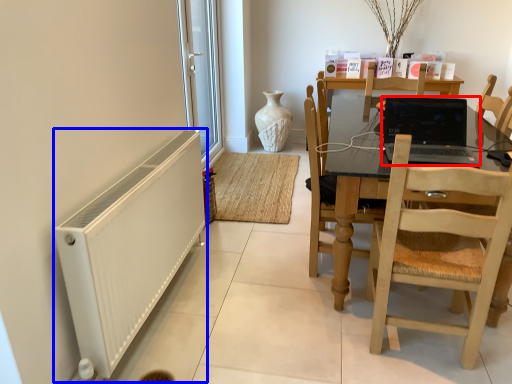
Question: Among these objects, which one is farthest to the camera, laptop (highlighted by a red box) or radiator (highlighted by a blue box)?

Choices:
 (A) laptop
 (B) radiator

Answer: (A)